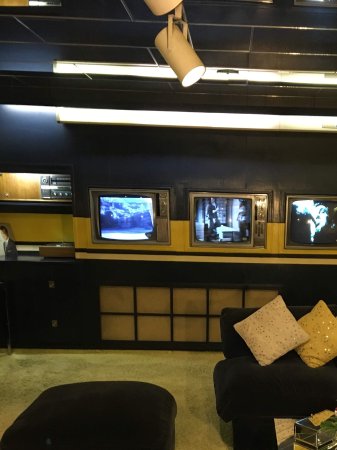
Find the location of `floor`. floor is located at coordinates (182, 381).